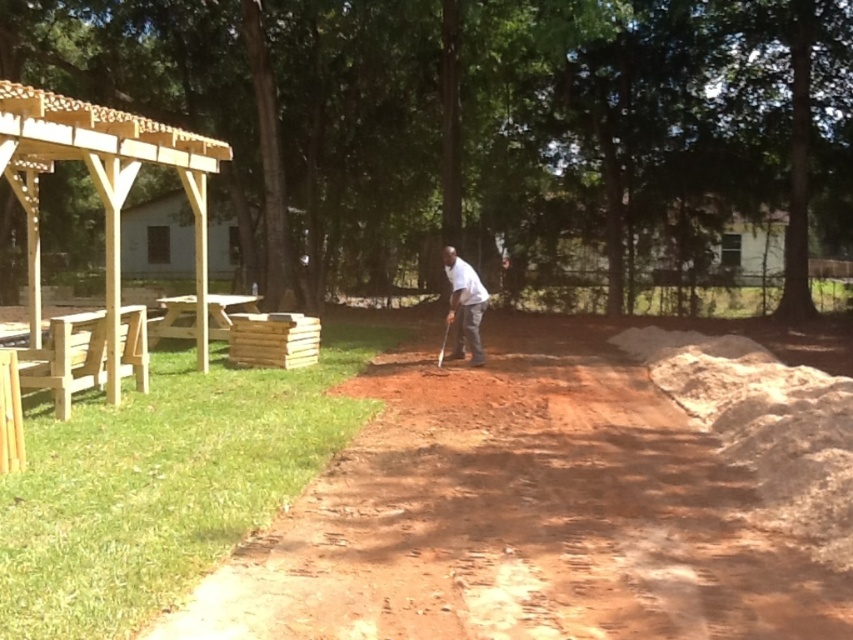
Can you confirm if brown wooden picnic table at left is smaller than white matte shirt at center?

Actually, brown wooden picnic table at left might be larger than white matte shirt at center.

What do you see at coordinates (67, 358) in the screenshot? The image size is (853, 640). I see `brown wooden picnic table at left` at bounding box center [67, 358].

Does point (96, 326) lie behind point (469, 296)?

No, (96, 326) is closer to viewer.

The height and width of the screenshot is (640, 853). I want to click on brown wooden picnic table at left, so click(x=67, y=358).

Can you confirm if brown dirt field at center is thinner than brown wooden picnic table at left?

In fact, brown dirt field at center might be wider than brown wooden picnic table at left.

Is point (469, 609) more distant than point (102, 330)?

No, (469, 609) is closer to viewer.

You are a GUI agent. You are given a task and a screenshot of the screen. Output one action in this format:
    pyautogui.click(x=<x>, y=<y>)
    Task: Click on the brown dirt field at center
    This screenshot has width=853, height=640.
    Given the screenshot: What is the action you would take?
    pyautogui.click(x=518, y=515)

Who is more distant from viewer, (323,588) or (54,122)?

Point (54,122)

Between point (579, 545) and point (183, 172), which one is positioned behind?

The point (183, 172) is more distant.

This screenshot has width=853, height=640. What are the coordinates of `brown dirt field at center` in the screenshot? It's located at (518, 515).